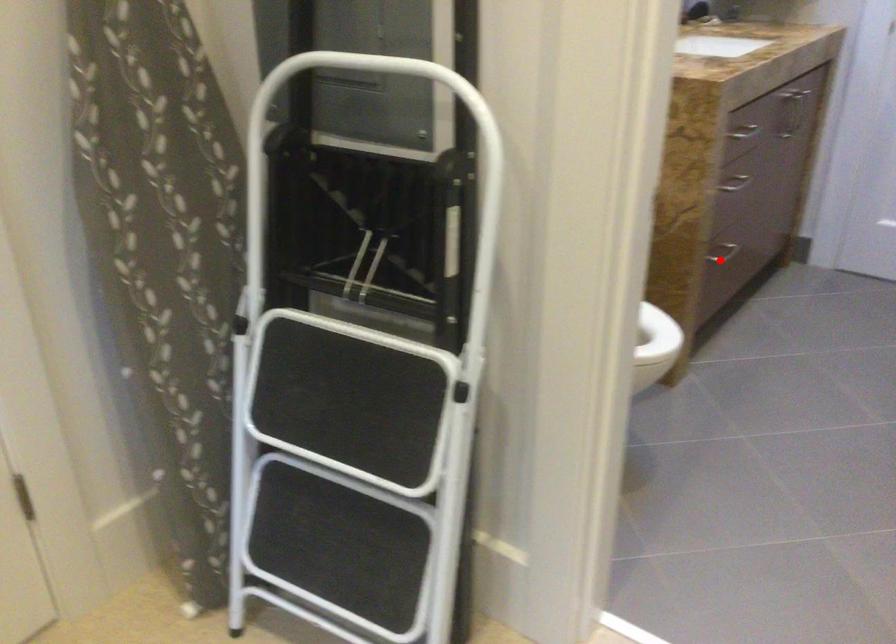
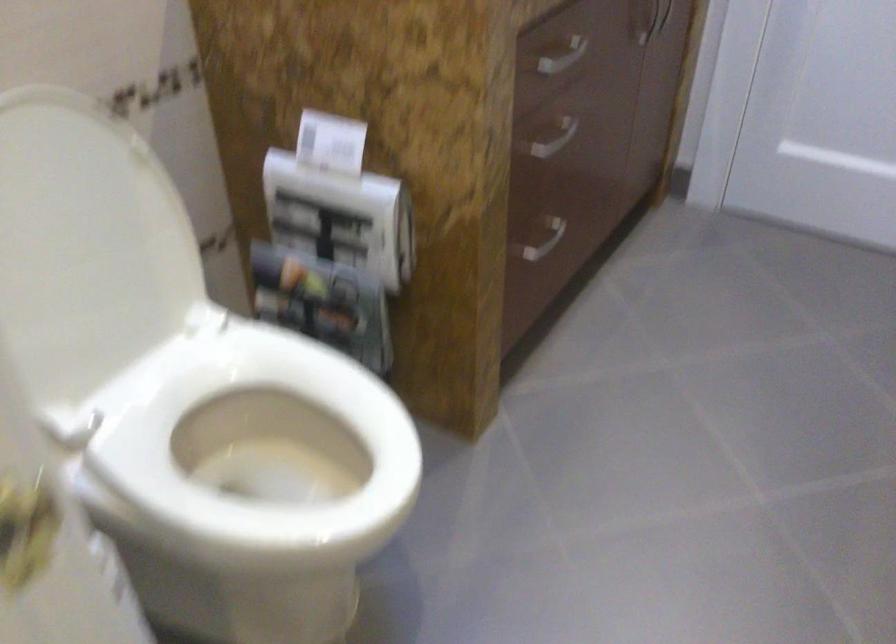
Question: I am providing you with two images of the same scene from different viewpoints. In image1, a red point is highlighted. Considering the same 3D point in image2, which of the following is correct?

Choices:
 (A) It is closer
 (B) It is farther

Answer: (A)